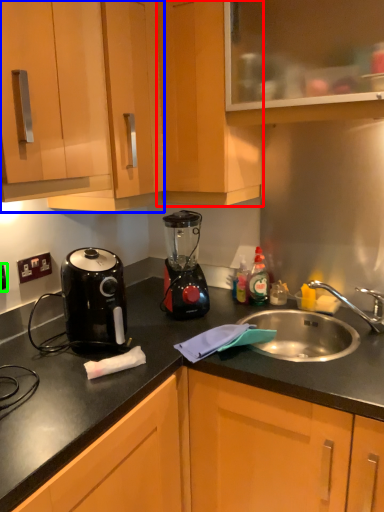
Question: Considering the real-world distances, which object is closest to cabinetry (highlighted by a red box)? cabinetry (highlighted by a blue box) or electric outlet (highlighted by a green box).

Choices:
 (A) cabinetry
 (B) electric outlet

Answer: (A)